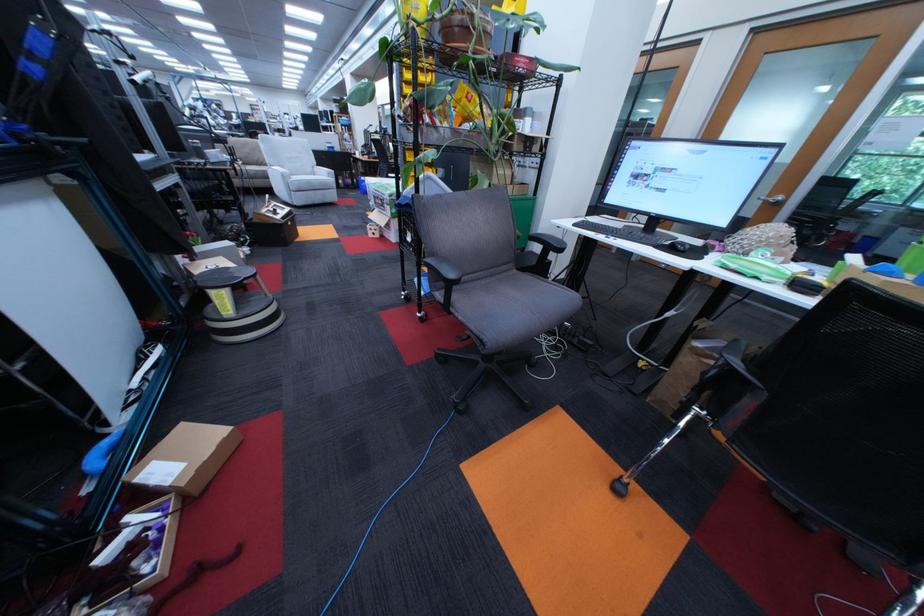
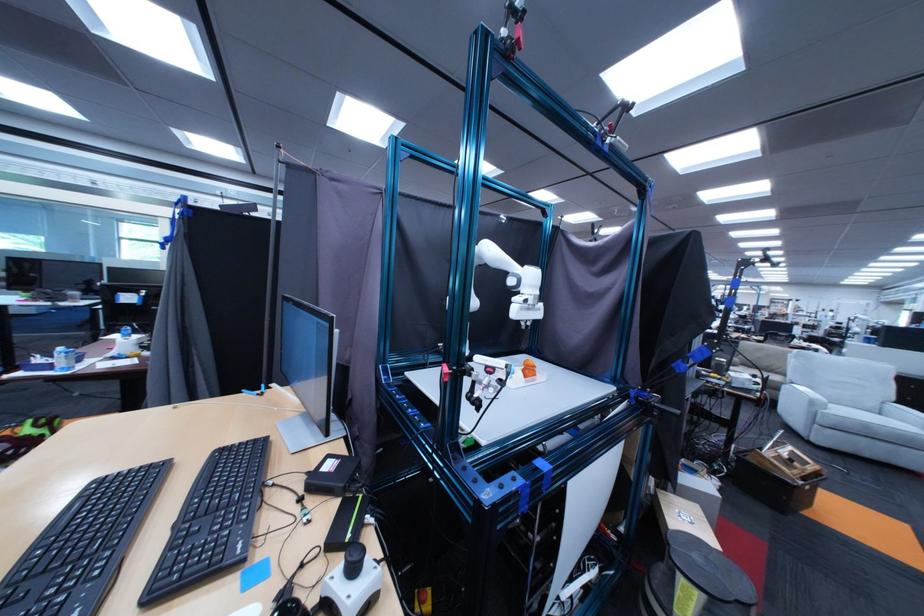
Locate, in the second image, the point that corresponds to pixel 322 183 in the first image.

(879, 426)